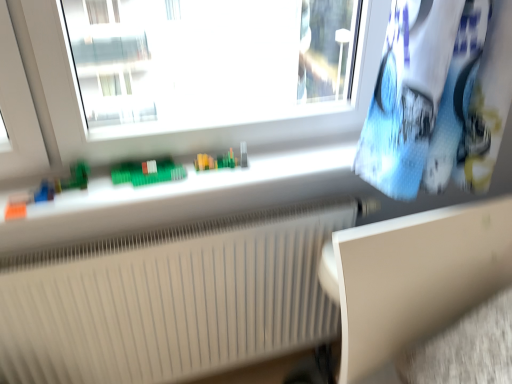
Question: Looking at the image, does white matte table at lower right seem bigger or smaller compared to white ribbed radiator at lower center?

Choices:
 (A) big
 (B) small

Answer: (B)

Question: Would you say white matte table at lower right is inside or outside white ribbed radiator at lower center?

Choices:
 (A) outside
 (B) inside

Answer: (A)

Question: Is point (339, 379) positioned closer to the camera than point (86, 261)?

Choices:
 (A) farther
 (B) closer

Answer: (B)

Question: Is point (303, 324) closer or farther from the camera than point (452, 266)?

Choices:
 (A) farther
 (B) closer

Answer: (A)

Question: Is white ribbed radiator at lower center inside the boundaries of white matte table at lower right, or outside?

Choices:
 (A) inside
 (B) outside

Answer: (B)

Question: Based on their positions, is white ribbed radiator at lower center located to the left or right of white matte table at lower right?

Choices:
 (A) left
 (B) right

Answer: (A)

Question: From their relative heights in the image, would you say white ribbed radiator at lower center is taller or shorter than white matte table at lower right?

Choices:
 (A) short
 (B) tall

Answer: (B)